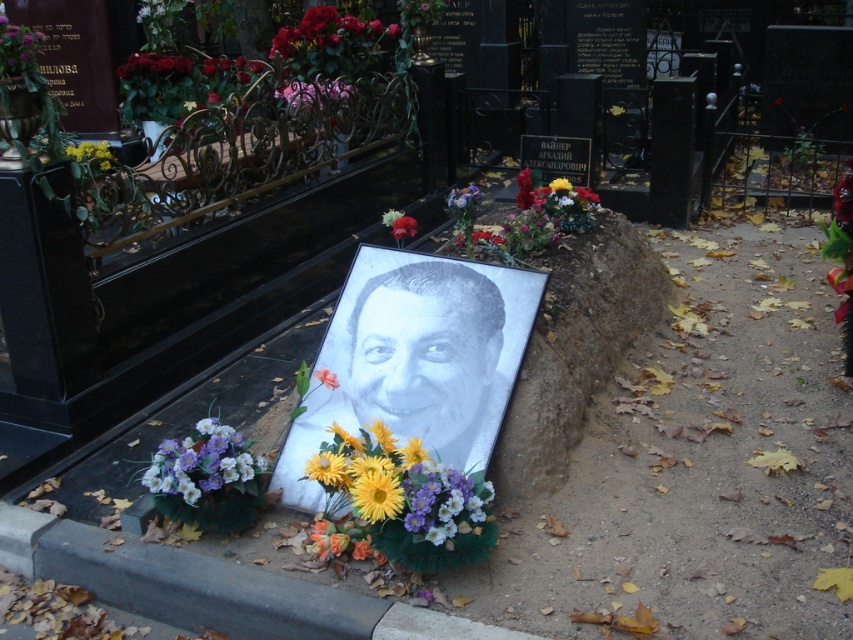
Question: Which of these objects is positioned farthest from the purple silk flowers at lower left?

Choices:
 (A) yellow fabric flower at center
 (B) smooth glossy rose at upper left
 (C) metallic purple flowers at upper center
 (D) purple matte flower at center

Answer: (B)

Question: Is smooth white portrait at center positioned before red matte flower at center?

Choices:
 (A) yes
 (B) no

Answer: (A)

Question: Does yellow matte flower at upper left have a smaller size compared to purple matte flower at center?

Choices:
 (A) yes
 (B) no

Answer: (B)

Question: Which object is positioned closest to the yellow paper flower at center?

Choices:
 (A) purple paper flower at center
 (B) purple matte flower at center
 (C) yellow fabric flower at center

Answer: (C)

Question: Is smooth white portrait at center bigger than purple matte flower at center?

Choices:
 (A) no
 (B) yes

Answer: (B)

Question: Estimate the real-world distances between objects in this image. Which object is closer to the smooth white portrait at center?

Choices:
 (A) smooth metallic vase at upper left
 (B) yellow paper flower at center
 (C) yellow fabric flower at center
 (D) purple silk flowers at lower left

Answer: (C)